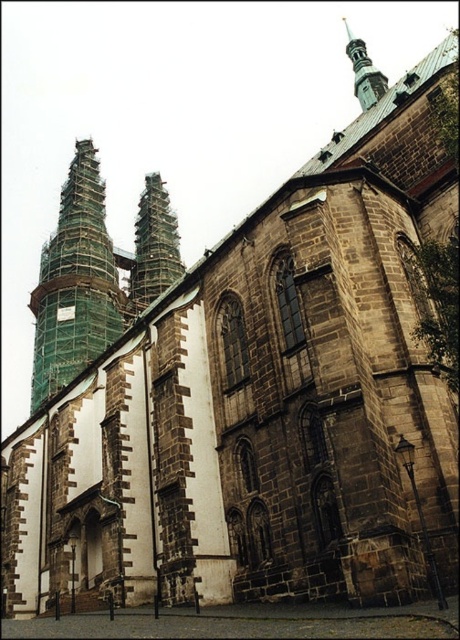
Which is more to the left, green scaffolding tower at left or green scaffolding tower at upper left?

Positioned to the left is green scaffolding tower at left.

Does green scaffolding tower at left have a greater width compared to green scaffolding tower at upper left?

Correct, the width of green scaffolding tower at left exceeds that of green scaffolding tower at upper left.

Is point (69, 340) positioned after point (137, 307)?

No, (69, 340) is closer to viewer.

At what (x,y) coordinates should I click in order to perform the action: click on green scaffolding tower at left. Please return your answer as a coordinate pair (x, y). Looking at the image, I should click on (74, 284).

Consider the image. Does green scaffolding tower at upper left appear on the left side of shiny silver spire at upper center?

Correct, you'll find green scaffolding tower at upper left to the left of shiny silver spire at upper center.

Which is below, green scaffolding tower at upper left or shiny silver spire at upper center?

green scaffolding tower at upper left

Is point (154, 276) more distant than point (360, 106)?

No, (154, 276) is in front of (360, 106).

Locate an element on the screen. The height and width of the screenshot is (640, 460). green scaffolding tower at upper left is located at coordinates (153, 248).

Is green scaffolding tower at left taller than shiny silver spire at upper center?

Incorrect, green scaffolding tower at left's height is not larger of shiny silver spire at upper center's.

Is point (104, 310) positioned in front of point (364, 106)?

No, it is behind (364, 106).

Image resolution: width=460 pixels, height=640 pixels. I want to click on green scaffolding tower at left, so click(74, 284).